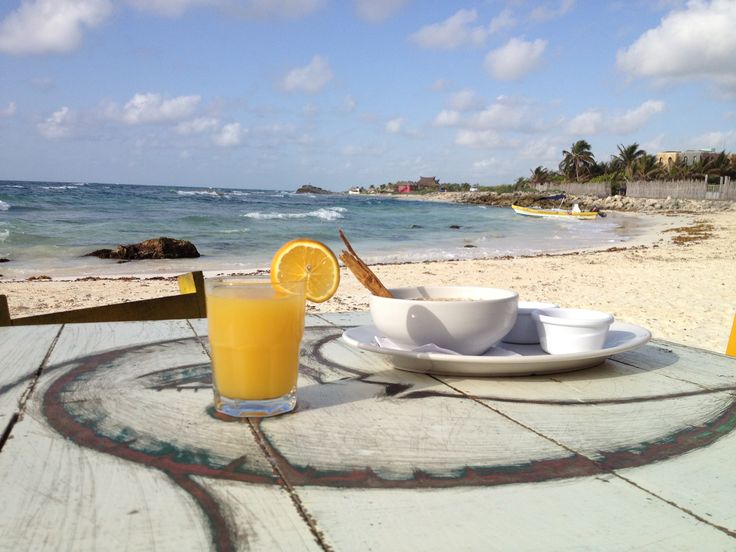
I want to click on wooden table, so click(x=394, y=451).